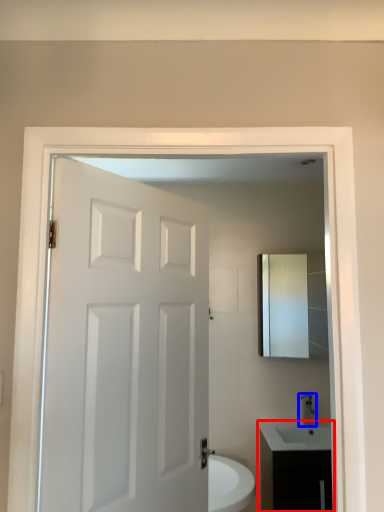
Question: Which object is closer to the camera taking this photo, bathroom cabinet (highlighted by a red box) or tap (highlighted by a blue box)?

Choices:
 (A) bathroom cabinet
 (B) tap

Answer: (A)